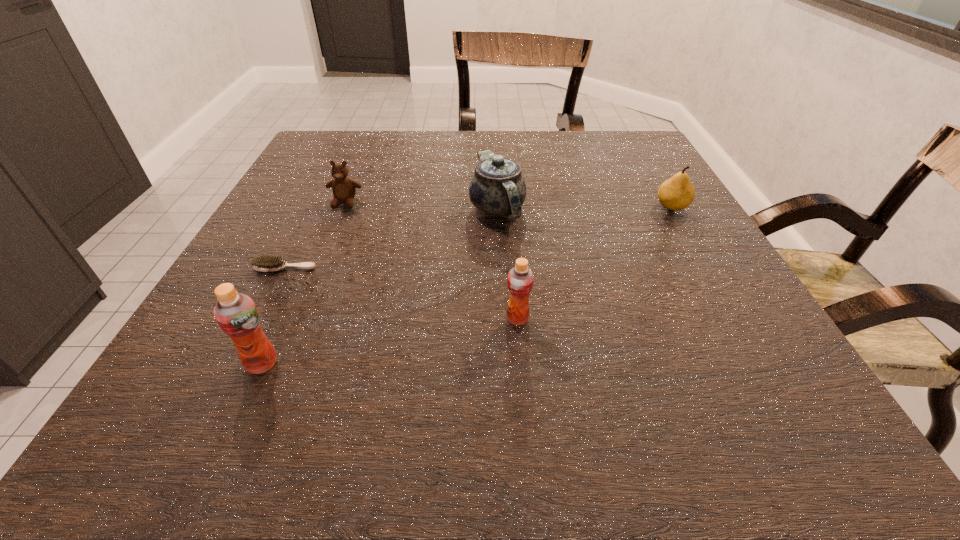
Locate an element on the screen. The image size is (960, 540). free location that satisfies the following two spatial constraints: 1. from the spout of the chinaware; 2. on the left side of the right orange juice is located at coordinates (503, 319).

Identify the location of vacant space that satisfies the following two spatial constraints: 1. on the back side of the nearer orange juice; 2. on the right side of the pear. (332, 207).

You are a GUI agent. You are given a task and a screenshot of the screen. Output one action in this format:
    pyautogui.click(x=<x>, y=<y>)
    Task: Click on the free space that satisfies the following two spatial constraints: 1. at the face of the teddy bear; 2. on the right side of the rightmost object
    This screenshot has width=960, height=540.
    Given the screenshot: What is the action you would take?
    pyautogui.click(x=343, y=207)

This screenshot has height=540, width=960. Identify the location of free location that satisfies the following two spatial constraints: 1. from the spout of the chinaware; 2. on the left side of the right orange juice. (503, 319).